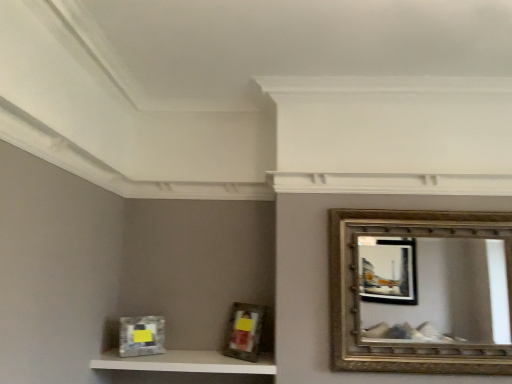
Question: Can we say white textured shelf at lower left lies outside metallic silver picture frame at lower left, the second picture frame positioned from the right?

Choices:
 (A) no
 (B) yes

Answer: (B)

Question: Is white textured shelf at lower left positioned before metallic silver picture frame at lower left, the second picture frame positioned from the right?

Choices:
 (A) yes
 (B) no

Answer: (A)

Question: Can metallic silver picture frame at lower left, the second picture frame positioned from the right, be found inside white textured shelf at lower left?

Choices:
 (A) yes
 (B) no

Answer: (B)

Question: Is white textured shelf at lower left touching metallic silver picture frame at lower left, the second picture frame positioned from the right?

Choices:
 (A) yes
 (B) no

Answer: (B)

Question: Is white textured shelf at lower left at the right side of metallic silver picture frame at lower left, the first picture frame from the left?

Choices:
 (A) no
 (B) yes

Answer: (B)

Question: Is white textured shelf at lower left shorter than metallic silver picture frame at lower left, the second picture frame positioned from the right?

Choices:
 (A) no
 (B) yes

Answer: (B)

Question: Is white textured shelf at lower left at the back of gold textured mirror at upper right?

Choices:
 (A) no
 (B) yes

Answer: (A)

Question: Is the position of gold textured mirror at upper right less distant than that of white textured shelf at lower left?

Choices:
 (A) no
 (B) yes

Answer: (B)

Question: Is gold textured mirror at upper right wider than white textured shelf at lower left?

Choices:
 (A) no
 (B) yes

Answer: (A)

Question: From the image's perspective, would you say gold textured mirror at upper right is positioned over white textured shelf at lower left?

Choices:
 (A) yes
 (B) no

Answer: (A)

Question: Does gold textured mirror at upper right have a smaller size compared to white textured shelf at lower left?

Choices:
 (A) yes
 (B) no

Answer: (B)

Question: From a real-world perspective, is gold textured mirror at upper right beneath white textured shelf at lower left?

Choices:
 (A) no
 (B) yes

Answer: (A)

Question: Is metallic silver picture frame at lower left, the second picture frame positioned from the right, looking in the opposite direction of white textured shelf at lower left?

Choices:
 (A) yes
 (B) no

Answer: (B)